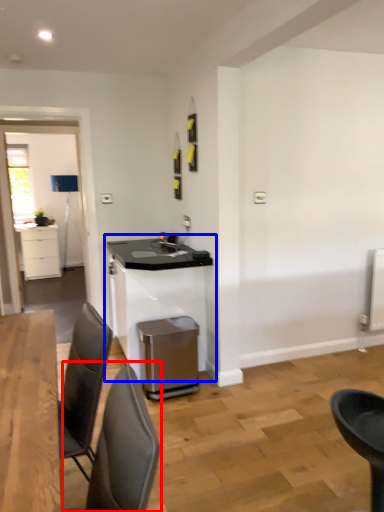
Question: Which object appears farthest to the camera in this image, chair (highlighted by a red box) or table (highlighted by a blue box)?

Choices:
 (A) chair
 (B) table

Answer: (B)